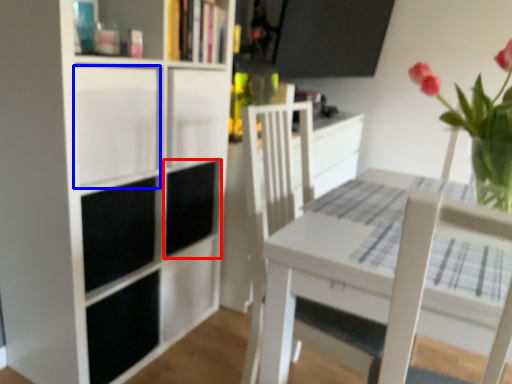
Question: Among these objects, which one is nearest to the camera, cabinet (highlighted by a red box) or cabinet (highlighted by a blue box)?

Choices:
 (A) cabinet
 (B) cabinet

Answer: (B)